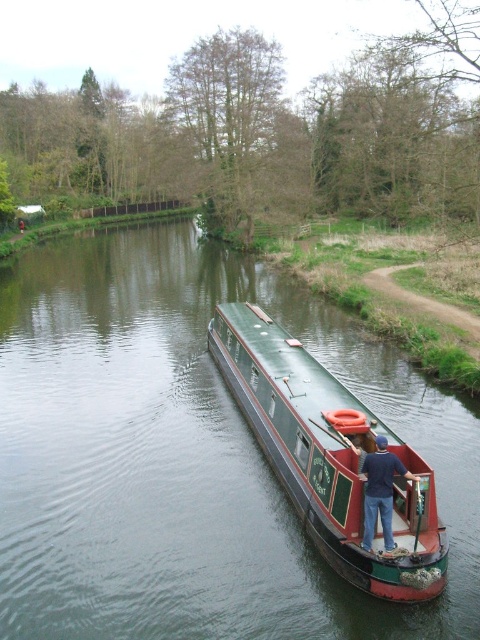
Is point (395, 609) farther from camera compared to point (374, 522)?

No, (395, 609) is in front of (374, 522).

Is point (266, 300) positioned before point (372, 531)?

No, (266, 300) is further to viewer.

I want to click on green polished wood boat at center, so click(x=188, y=454).

Is green painted wood boat at center behind dark blue shirt at center?

No, it is in front of dark blue shirt at center.

Is green painted wood boat at center taller than dark blue shirt at center?

Indeed, green painted wood boat at center has a greater height compared to dark blue shirt at center.

At what (x,y) coordinates should I click in order to perform the action: click on green painted wood boat at center. Please return your answer as a coordinate pair (x, y). Image resolution: width=480 pixels, height=640 pixels. Looking at the image, I should click on (332, 458).

Can you confirm if green polished wood boat at center is smaller than green painted wood boat at center?

Actually, green polished wood boat at center might be larger than green painted wood boat at center.

Does green polished wood boat at center come behind green painted wood boat at center?

No, green polished wood boat at center is closer to the viewer.

Between point (88, 548) and point (384, 582), which one is positioned behind?

Point (88, 548)

Locate an element on the screen. The width and height of the screenshot is (480, 640). green polished wood boat at center is located at coordinates (188, 454).